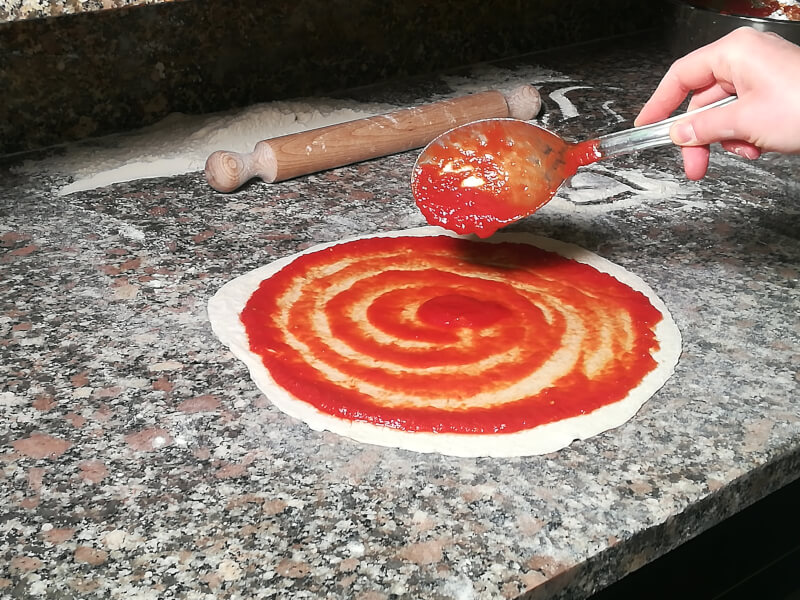
Where is `rolling pin`? Image resolution: width=800 pixels, height=600 pixels. rolling pin is located at coordinates (316, 132).